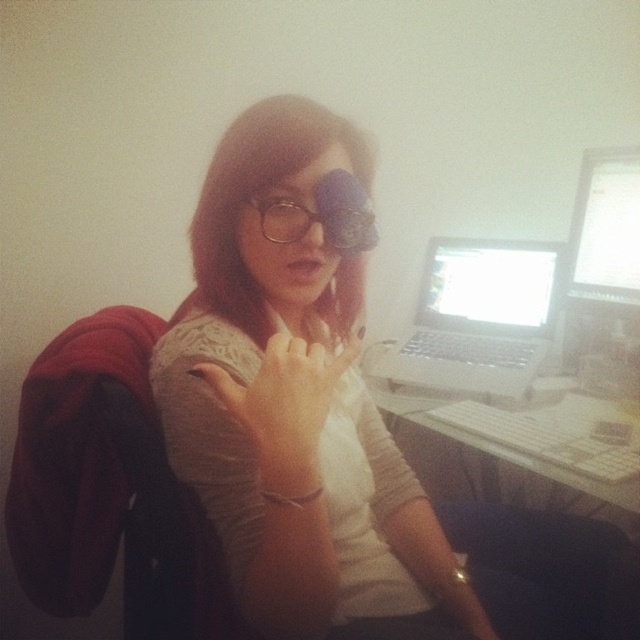
You are trying to determine if the matte black glasses at center can be placed on top of the white glossy laptop at upper right without falling off. Based on their sizes, is this possible?

The matte black glasses at center might be wider than white glossy laptop at upper right, so placing them on top could cause instability and potential falling.

You are a photographer taking a photo of the scene described. The matte silver laptop at upper right is important to capture clearly. Where should you position your camera to ensure it is centered in the frame?

To center the matte silver laptop at upper right in the frame, position the camera so that its lens aligns with the coordinates provided, ensuring the laptop is at the center point of the image. Since the laptop is located at point (x=605, y=227), adjusting the camera to focus on this coordinate will center it.